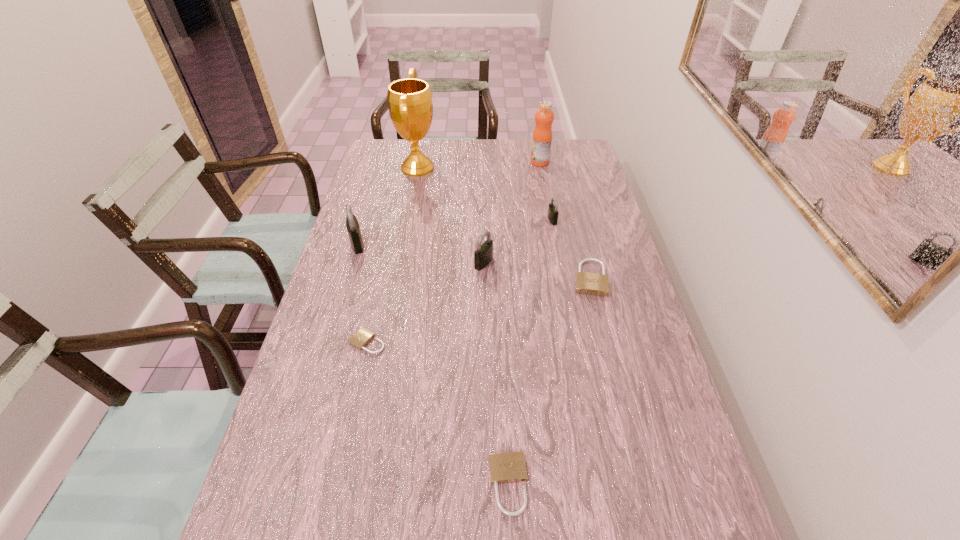
Find the location of a particular element. The image size is (960, 540). empty space that is in between the second nearest beige padlock and the nearest beige padlock is located at coordinates (438, 413).

Find the location of `unoccupied area between the second tallest padlock and the leftmost object`. unoccupied area between the second tallest padlock and the leftmost object is located at coordinates (420, 254).

This screenshot has height=540, width=960. Identify the location of object that is the second closest to the leftmost object. pyautogui.click(x=363, y=336).

Locate which object ranks fourth in proximity to the second farthest black padlock. Please provide its 2D coordinates. Your answer should be formatted as a tuple, i.e. [(x, y)], where the tuple contains the x and y coordinates of a point satisfying the conditions above.

[(552, 215)]

This screenshot has height=540, width=960. I want to click on padlock that can be found as the fourth closest to the fruit juice, so click(x=352, y=225).

Locate which padlock is the second closest to the leftmost padlock. Please provide its 2D coordinates. Your answer should be formatted as a tuple, i.e. [(x, y)], where the tuple contains the x and y coordinates of a point satisfying the conditions above.

[(483, 255)]

Locate an element on the screen. The width and height of the screenshot is (960, 540). black padlock that is the second closest to the tallest object is located at coordinates (483, 255).

Locate which black padlock ranks in proximity to the second beige padlock from right to left. Please provide its 2D coordinates. Your answer should be formatted as a tuple, i.e. [(x, y)], where the tuple contains the x and y coordinates of a point satisfying the conditions above.

[(483, 255)]

Image resolution: width=960 pixels, height=540 pixels. I want to click on beige padlock object that ranks as the closest to the shortest object, so click(x=509, y=467).

The image size is (960, 540). Find the location of `the second closest beige padlock relative to the seventh tallest object`. the second closest beige padlock relative to the seventh tallest object is located at coordinates (588, 283).